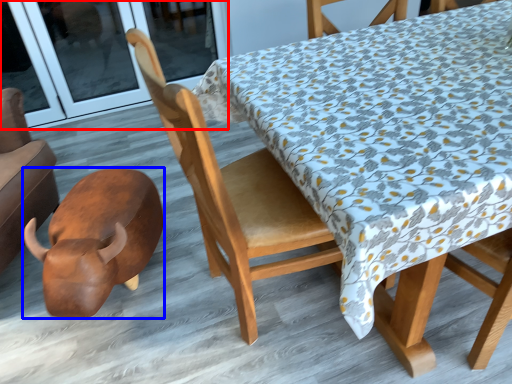
Question: Among these objects, which one is nearest to the camera, screen door (highlighted by a red box) or animal (highlighted by a blue box)?

Choices:
 (A) screen door
 (B) animal

Answer: (B)